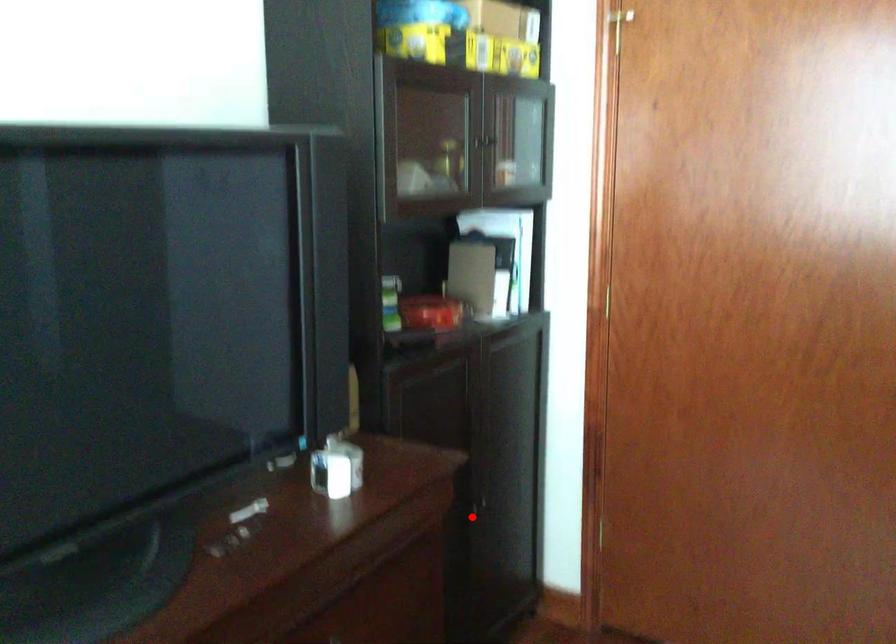
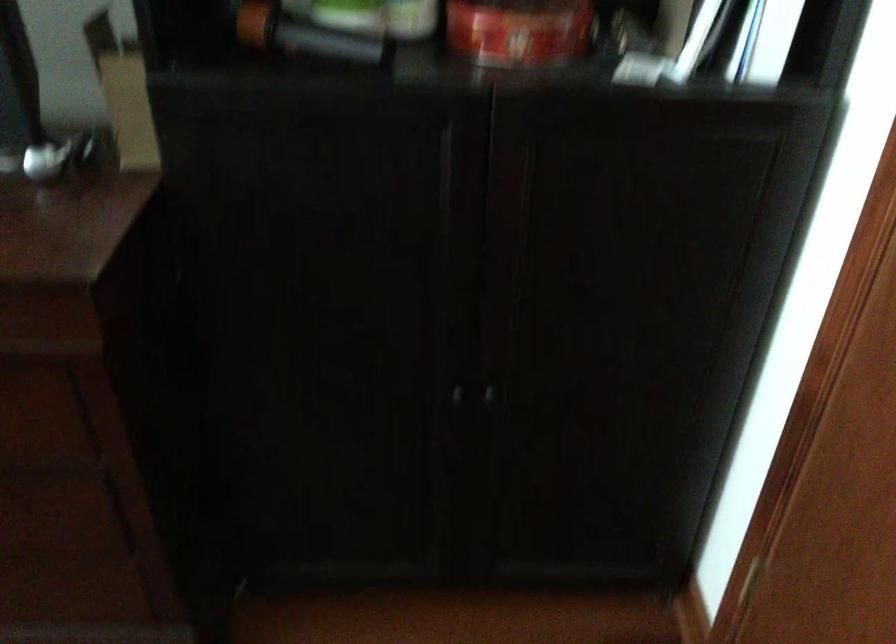
Question: I am providing you with two images of the same scene from different viewpoints. Image1 has a red point marked. In image2, the corresponding 3D location appears at what relative position? Reply with the corresponding letter.

Choices:
 (A) Closer
 (B) Farther

Answer: (A)